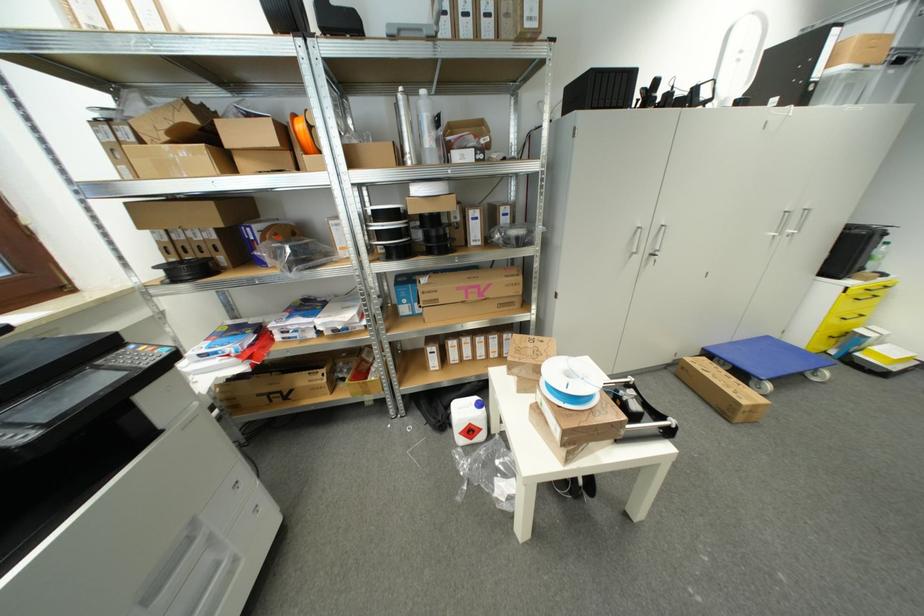
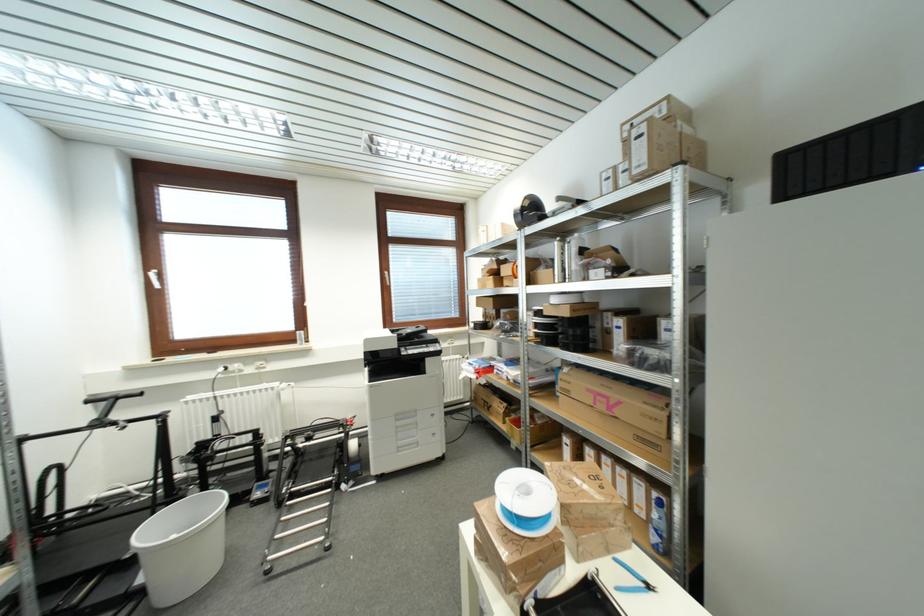
Find the pixel in the second image that matches (501,342) in the first image.

(648, 493)